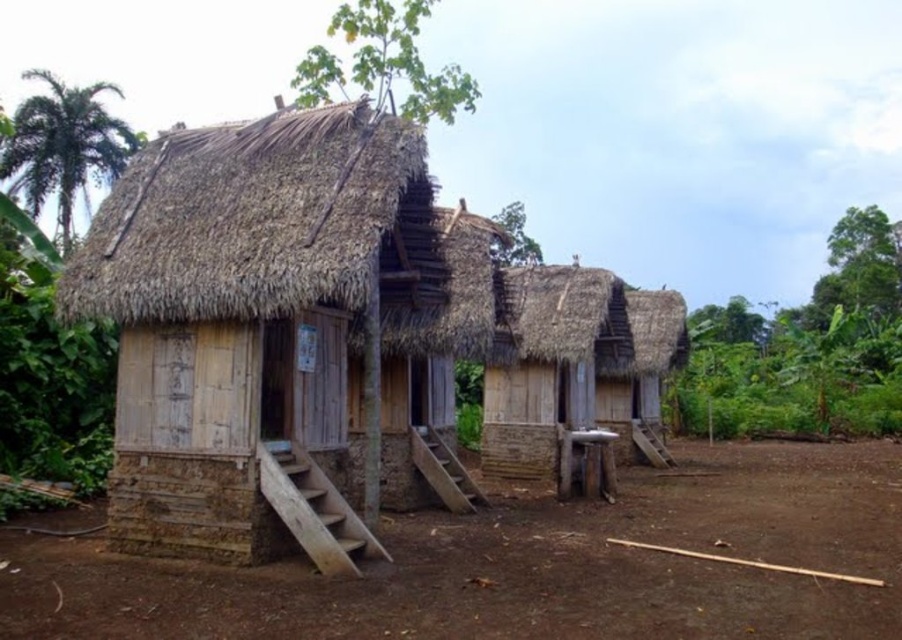
Is wooden hut at left closer to the viewer compared to green leafy vegetation at right?

That is True.

Is wooden hut at left thinner than green leafy vegetation at right?

Correct, wooden hut at left's width is less than green leafy vegetation at right's.

Is point (361, 156) positioned before point (682, 406)?

Yes, point (361, 156) is in front of point (682, 406).

You are a GUI agent. You are given a task and a screenshot of the screen. Output one action in this format:
    pyautogui.click(x=<x>, y=<y>)
    Task: Click on the wooden hut at left
    
    Given the screenshot: What is the action you would take?
    pyautogui.click(x=281, y=333)

Can you confirm if wooden hut at left is smaller than brown dirt field at lower center?

Correct, wooden hut at left occupies less space than brown dirt field at lower center.

Describe the element at coordinates (281, 333) in the screenshot. I see `wooden hut at left` at that location.

Image resolution: width=902 pixels, height=640 pixels. I want to click on wooden hut at left, so click(281, 333).

Which is behind, point (190, 380) or point (355, 129)?

Point (355, 129)

Is point (191, 244) positioned in front of point (309, 195)?

That is False.

Find the location of a particular element. The width and height of the screenshot is (902, 640). wooden hut at left is located at coordinates (281, 333).